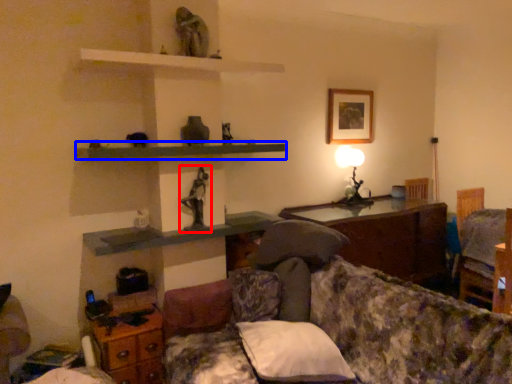
Question: Which point is further to the camera, sculpture (highlighted by a red box) or shelf (highlighted by a blue box)?

Choices:
 (A) sculpture
 (B) shelf

Answer: (A)